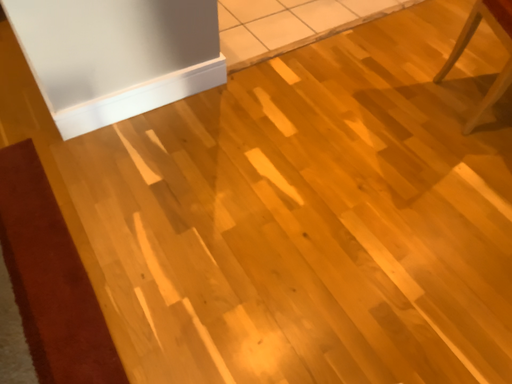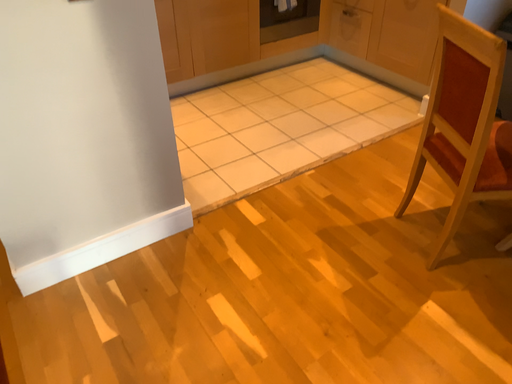
Question: How did the camera likely rotate when shooting the video?

Choices:
 (A) rotated downward
 (B) rotated upward

Answer: (B)